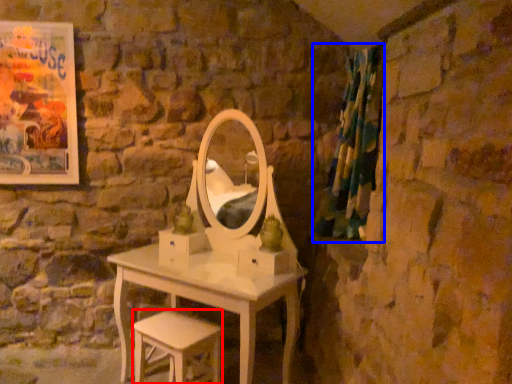
Question: Among these objects, which one is farthest to the camera, stool (highlighted by a red box) or curtain (highlighted by a blue box)?

Choices:
 (A) stool
 (B) curtain

Answer: (B)